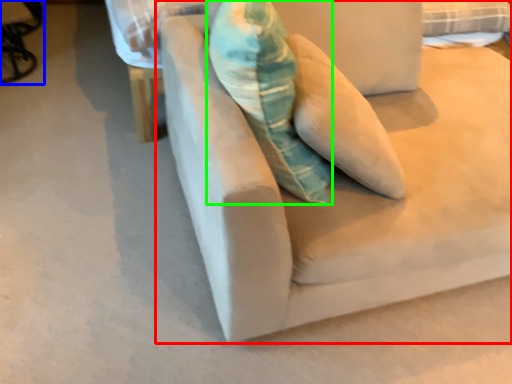
Question: Estimate the real-world distances between objects in this image. Which object is closer to studio couch (highlighted by a red box), swivel chair (highlighted by a blue box) or throw pillow (highlighted by a green box)?

Choices:
 (A) swivel chair
 (B) throw pillow

Answer: (B)